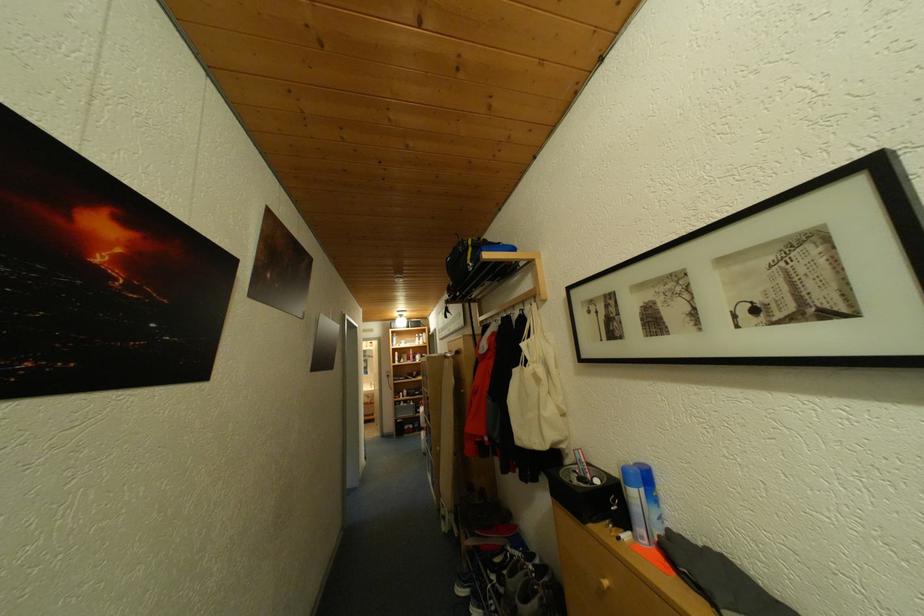
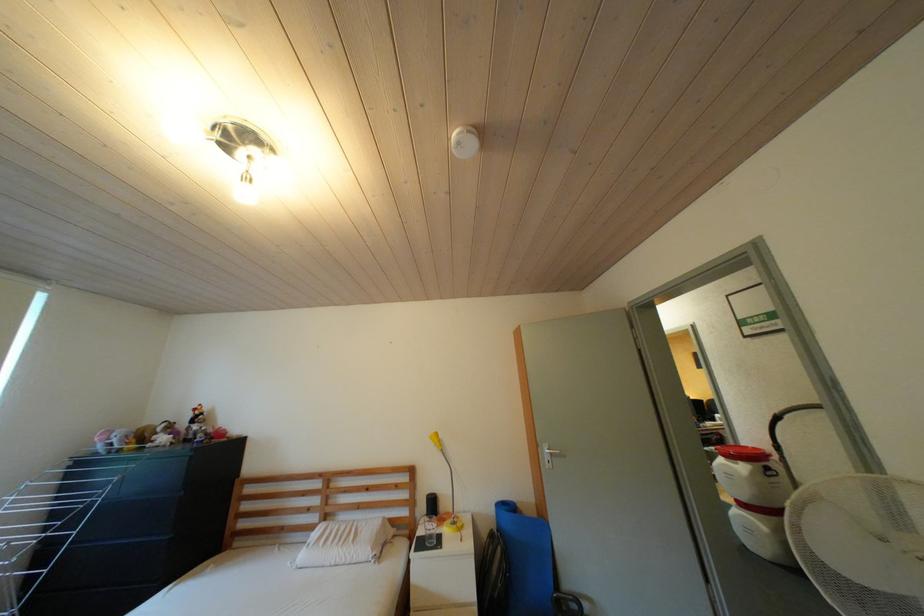
In a continuous first-person perspective shot, in which direction is the camera moving?

The movement direction of the cameraman is left, forward.